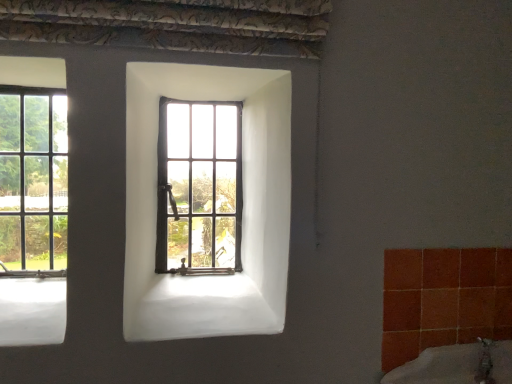
Question: Can clear glass window at left, placed as the second window when sorted from right to left, be found inside white ceramic bath at lower right?

Choices:
 (A) yes
 (B) no

Answer: (B)

Question: Considering the relative positions of white ceramic bath at lower right and clear glass window at left, placed as the second window when sorted from right to left, in the image provided, is white ceramic bath at lower right in front of clear glass window at left, placed as the second window when sorted from right to left,?

Choices:
 (A) no
 (B) yes

Answer: (B)

Question: Does white ceramic bath at lower right appear on the right side of clear glass window at left, placed as the second window when sorted from right to left?

Choices:
 (A) no
 (B) yes

Answer: (B)

Question: From a real-world perspective, is white ceramic bath at lower right positioned over clear glass window at left, the 1th window in the left-to-right sequence, based on gravity?

Choices:
 (A) no
 (B) yes

Answer: (A)

Question: Can you confirm if white ceramic bath at lower right is taller than clear glass window at left, placed as the second window when sorted from right to left?

Choices:
 (A) yes
 (B) no

Answer: (B)

Question: Visually, is wooden-framed window at center, the 2th window when ordered from left to right, positioned to the left or to the right of clear glass window at left, placed as the second window when sorted from right to left?

Choices:
 (A) left
 (B) right

Answer: (B)

Question: Considering the positions of wooden-framed window at center, the 2th window when ordered from left to right, and clear glass window at left, the 1th window in the left-to-right sequence, in the image, is wooden-framed window at center, the 2th window when ordered from left to right, taller or shorter than clear glass window at left, the 1th window in the left-to-right sequence,?

Choices:
 (A) short
 (B) tall

Answer: (A)

Question: From the image's perspective, is wooden-framed window at center, which is counted as the first window, starting from the right, located above or below clear glass window at left, the 1th window in the left-to-right sequence?

Choices:
 (A) above
 (B) below

Answer: (B)

Question: In terms of size, does wooden-framed window at center, which is counted as the first window, starting from the right, appear bigger or smaller than clear glass window at left, placed as the second window when sorted from right to left?

Choices:
 (A) small
 (B) big

Answer: (B)

Question: In the image, is wooden-framed window at center, which is counted as the first window, starting from the right, positioned in front of or behind white ceramic bath at lower right?

Choices:
 (A) front
 (B) behind

Answer: (B)

Question: From the image's perspective, is wooden-framed window at center, which is counted as the first window, starting from the right, located above or below white ceramic bath at lower right?

Choices:
 (A) below
 (B) above

Answer: (B)

Question: Is wooden-framed window at center, the 2th window when ordered from left to right, to the left or to the right of white ceramic bath at lower right in the image?

Choices:
 (A) left
 (B) right

Answer: (A)

Question: Does point click(x=174, y=241) appear closer or farther from the camera than point click(x=510, y=345)?

Choices:
 (A) closer
 (B) farther

Answer: (B)

Question: Is clear glass window at left, the 1th window in the left-to-right sequence, inside the boundaries of wooden-framed window at center, which is counted as the first window, starting from the right, or outside?

Choices:
 (A) inside
 (B) outside

Answer: (B)

Question: Considering the positions of point (7, 137) and point (194, 200), is point (7, 137) closer or farther from the camera than point (194, 200)?

Choices:
 (A) closer
 (B) farther

Answer: (A)